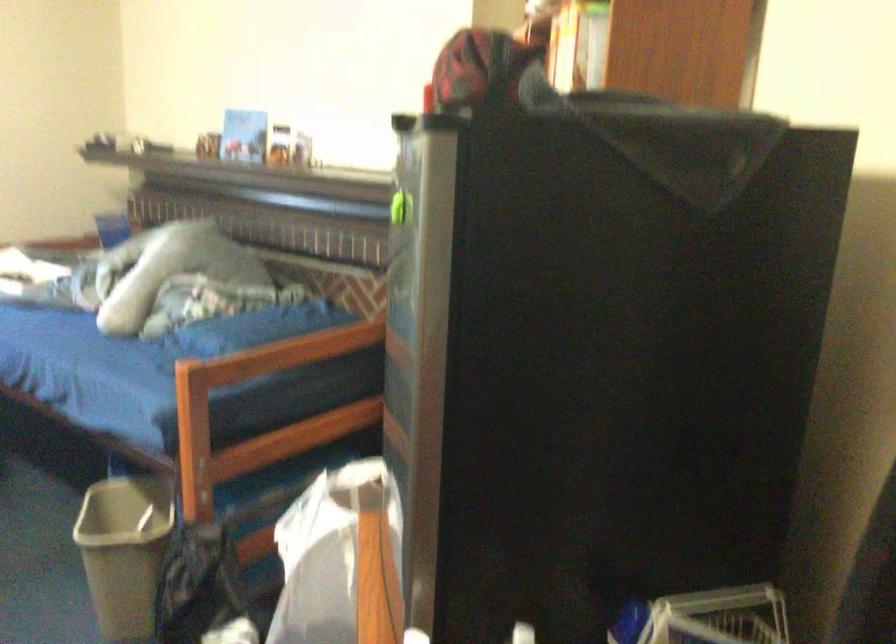
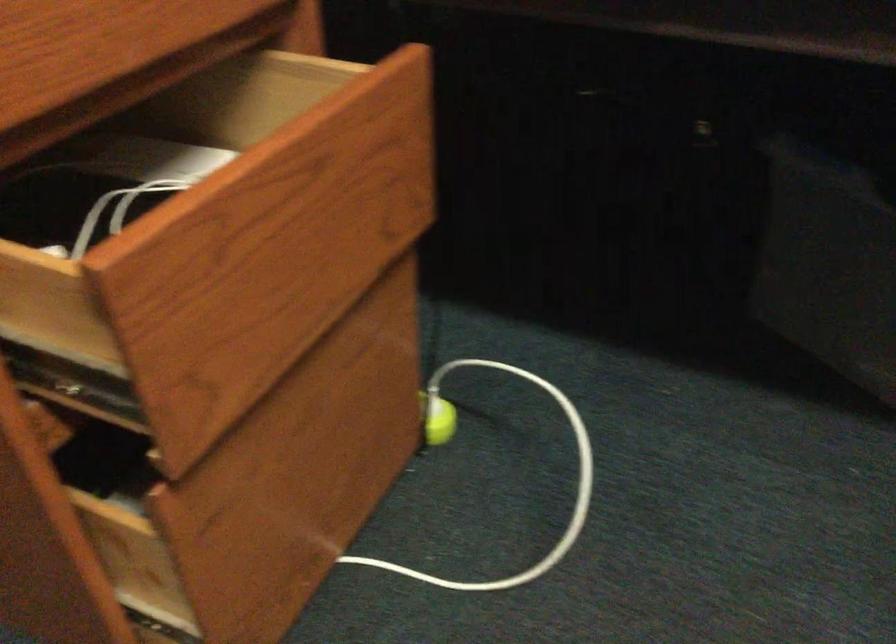
The images are taken continuously from a first-person perspective. In which direction are you moving?

The cameraman moved toward left, forward.